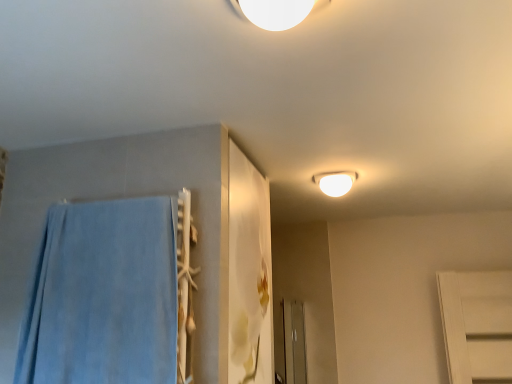
Question: Is white glossy light fixture at upper center wider or thinner than blue soft towel at left?

Choices:
 (A) thin
 (B) wide

Answer: (B)

Question: From the image's perspective, is white glossy light fixture at upper center above or below blue soft towel at left?

Choices:
 (A) above
 (B) below

Answer: (A)

Question: Does point (342, 192) appear closer or farther from the camera than point (79, 213)?

Choices:
 (A) farther
 (B) closer

Answer: (A)

Question: From the image's perspective, is blue soft towel at left above or below white glossy light fixture at upper center?

Choices:
 (A) below
 (B) above

Answer: (A)

Question: Based on their sizes in the image, would you say blue soft towel at left is bigger or smaller than white glossy light fixture at upper center?

Choices:
 (A) big
 (B) small

Answer: (A)

Question: Is point (154, 292) positioned closer to the camera than point (351, 173)?

Choices:
 (A) farther
 (B) closer

Answer: (B)

Question: In terms of width, does blue soft towel at left look wider or thinner when compared to white glossy light fixture at upper center?

Choices:
 (A) thin
 (B) wide

Answer: (A)